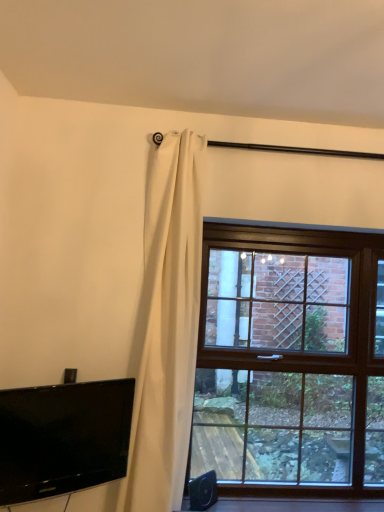
Question: Is black glossy tv at lower left completely or partially outside of brown wooden window at right?

Choices:
 (A) yes
 (B) no

Answer: (A)

Question: Is there a large distance between black glossy tv at lower left and brown wooden window at right?

Choices:
 (A) yes
 (B) no

Answer: (B)

Question: Considering the relative sizes of black glossy tv at lower left and brown wooden window at right in the image provided, is black glossy tv at lower left wider than brown wooden window at right?

Choices:
 (A) no
 (B) yes

Answer: (A)

Question: Could brown wooden window at right be considered to be inside black glossy tv at lower left?

Choices:
 (A) no
 (B) yes

Answer: (A)

Question: From the image's perspective, is black glossy tv at lower left beneath brown wooden window at right?

Choices:
 (A) no
 (B) yes

Answer: (B)

Question: Is black glossy tv at lower left shorter than brown wooden window at right?

Choices:
 (A) no
 (B) yes

Answer: (B)

Question: Does white matte curtain at upper left appear on the right side of black glossy tv at lower left?

Choices:
 (A) yes
 (B) no

Answer: (A)

Question: Is white matte curtain at upper left at the left side of black glossy tv at lower left?

Choices:
 (A) no
 (B) yes

Answer: (A)

Question: Does white matte curtain at upper left lie in front of black glossy tv at lower left?

Choices:
 (A) no
 (B) yes

Answer: (A)

Question: Is white matte curtain at upper left outside black glossy tv at lower left?

Choices:
 (A) yes
 (B) no

Answer: (A)

Question: Does white matte curtain at upper left have a smaller size compared to black glossy tv at lower left?

Choices:
 (A) no
 (B) yes

Answer: (A)

Question: Could black glossy tv at lower left be considered to be inside white matte curtain at upper left?

Choices:
 (A) yes
 (B) no

Answer: (A)

Question: Is brown wooden window at right not near black glossy tv at lower left?

Choices:
 (A) no
 (B) yes

Answer: (A)